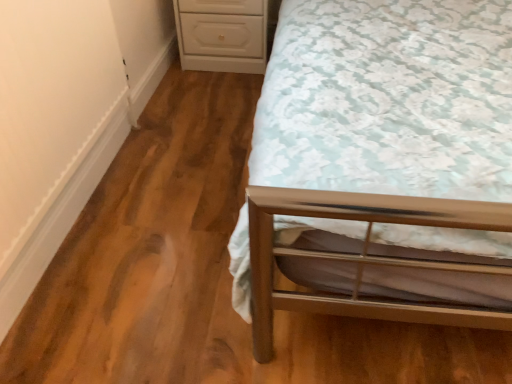
Question: Should I look upward or downward to see metallic silver bed at right?

Choices:
 (A) up
 (B) down

Answer: (A)

Question: From the image's perspective, is metallic silver bed at right on white glossy chest of drawers at upper center?

Choices:
 (A) no
 (B) yes

Answer: (A)

Question: Does metallic silver bed at right lie behind white glossy chest of drawers at upper center?

Choices:
 (A) no
 (B) yes

Answer: (A)

Question: From the image's perspective, would you say metallic silver bed at right is shown under white glossy chest of drawers at upper center?

Choices:
 (A) no
 (B) yes

Answer: (B)

Question: Is metallic silver bed at right with white glossy chest of drawers at upper center?

Choices:
 (A) yes
 (B) no

Answer: (B)

Question: Is metallic silver bed at right not close to white glossy chest of drawers at upper center?

Choices:
 (A) no
 (B) yes

Answer: (B)

Question: Does metallic silver bed at right lie in front of white glossy chest of drawers at upper center?

Choices:
 (A) no
 (B) yes

Answer: (B)

Question: Could you tell me if white glossy chest of drawers at upper center is turned towards metallic silver bed at right?

Choices:
 (A) yes
 (B) no

Answer: (B)

Question: Does white glossy chest of drawers at upper center have a lesser width compared to metallic silver bed at right?

Choices:
 (A) yes
 (B) no

Answer: (A)

Question: From a real-world perspective, is white glossy chest of drawers at upper center physically above metallic silver bed at right?

Choices:
 (A) no
 (B) yes

Answer: (A)

Question: Is white glossy chest of drawers at upper center directly adjacent to metallic silver bed at right?

Choices:
 (A) yes
 (B) no

Answer: (B)

Question: From the image's perspective, is white glossy chest of drawers at upper center below metallic silver bed at right?

Choices:
 (A) no
 (B) yes

Answer: (A)

Question: Is white glossy chest of drawers at upper center wider than metallic silver bed at right?

Choices:
 (A) no
 (B) yes

Answer: (A)

Question: Considering the positions of metallic silver bed at right and white glossy chest of drawers at upper center in the image, is metallic silver bed at right bigger or smaller than white glossy chest of drawers at upper center?

Choices:
 (A) big
 (B) small

Answer: (A)